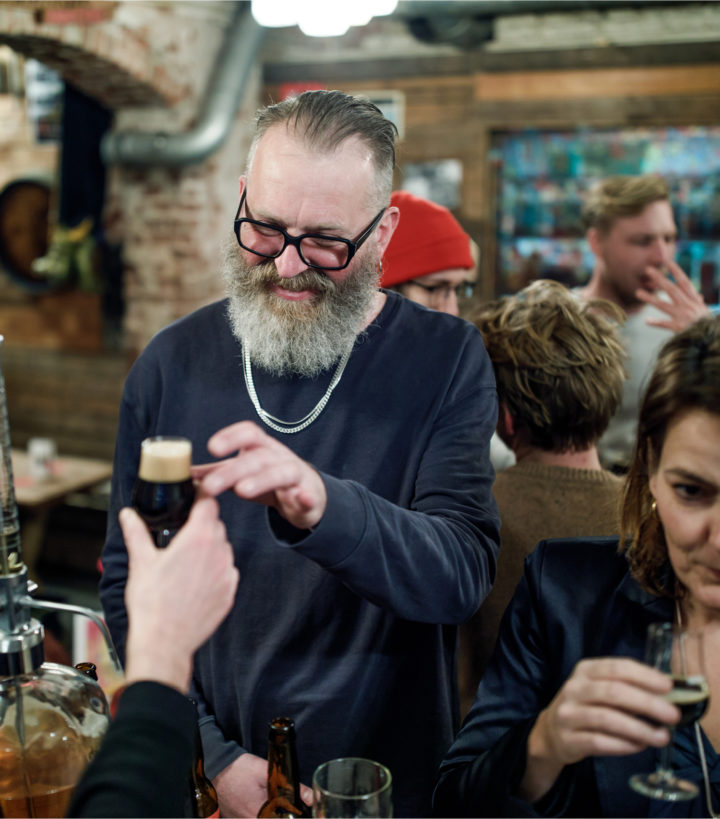
What are the coordinates of `brick wall` in the screenshot? It's located at (153, 247).